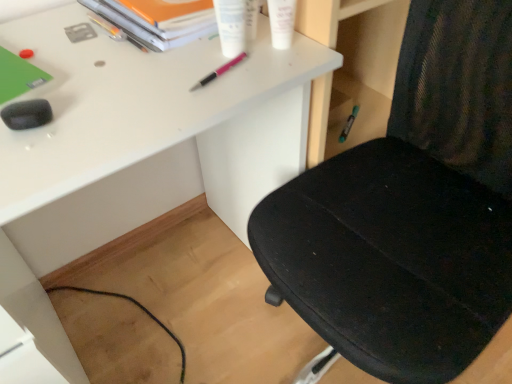
Image resolution: width=512 pixels, height=384 pixels. I want to click on vacant location behind matte black earbuds at left, the first stationery when ordered from left to right, so click(67, 62).